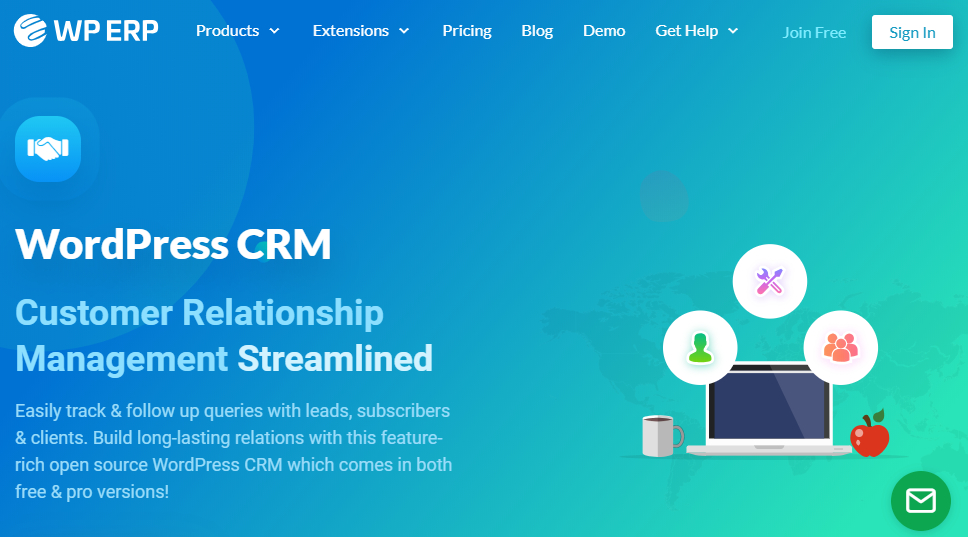
Locate an element on the screen. This screenshot has height=537, width=968. laptop screen is located at coordinates (790, 416).